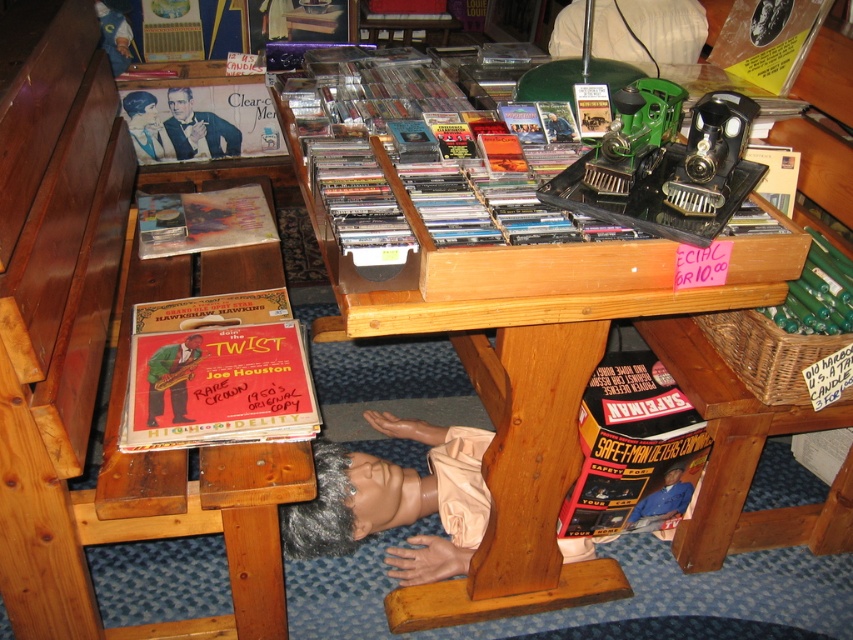
Question: Is hardcover book at lower right bigger than matte black record album at upper left?

Choices:
 (A) no
 (B) yes

Answer: (B)

Question: Can you confirm if matte plastic record album at upper left is positioned to the right of smooth vinyl record at lower left?

Choices:
 (A) yes
 (B) no

Answer: (B)

Question: Which object is closer to the camera taking this photo?

Choices:
 (A) smooth beige mannequin head at lower center
 (B) matte black record album at upper left

Answer: (A)

Question: In this image, where is hardcover book at lower right located relative to smooth vinyl record at lower left?

Choices:
 (A) below
 (B) above

Answer: (A)

Question: Which object is the closest to the hardcover book at lower right?

Choices:
 (A) smooth vinyl record at lower left
 (B) wooden table at center

Answer: (B)

Question: Which of the following is the closest to the observer?

Choices:
 (A) smooth vinyl record at lower left
 (B) matte vinyl record at lower left

Answer: (B)